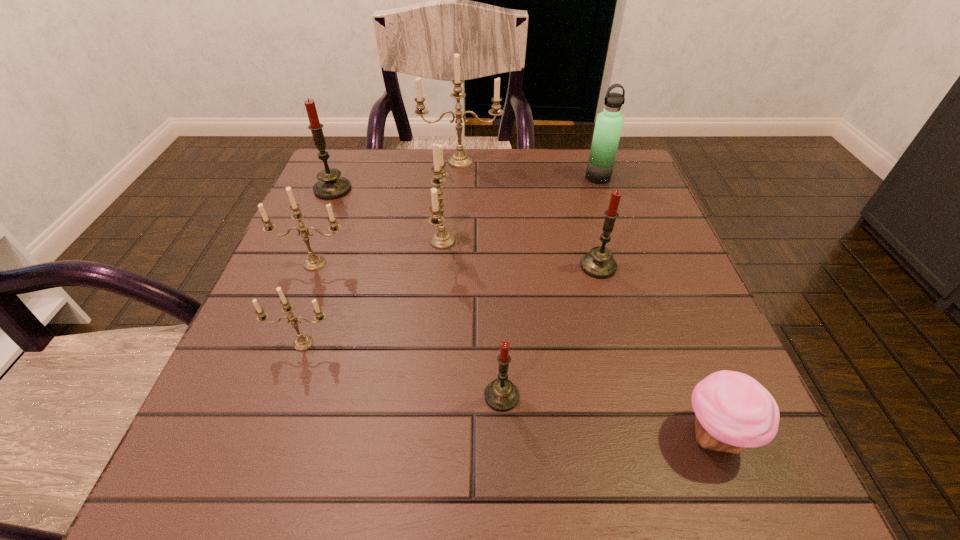
Identify the location of the nearest candle. (501, 395).

The height and width of the screenshot is (540, 960). What are the coordinates of `the nearest metallic candle` in the screenshot? It's located at (303, 342).

Where is `the second nearest candle`? the second nearest candle is located at coordinates (303, 342).

Identify the location of the shortest object. The image size is (960, 540). (733, 411).

Where is `pink cupcake`? This screenshot has height=540, width=960. pink cupcake is located at coordinates (733, 411).

I want to click on blank space located on the front of the farthest candle, so click(x=454, y=265).

Identify the location of free space located on the left of the thermos bottle. (426, 177).

Locate an element on the screen. The width and height of the screenshot is (960, 540). vacant point located 0.160m on the front of the sixth nearest candle is located at coordinates (310, 245).

Find the location of a particular element. The height and width of the screenshot is (540, 960). vacant space located 0.070m on the right of the third smallest metallic candle is located at coordinates (489, 241).

Locate an element on the screen. The height and width of the screenshot is (540, 960). free region located on the back of the second smallest red candle is located at coordinates (572, 171).